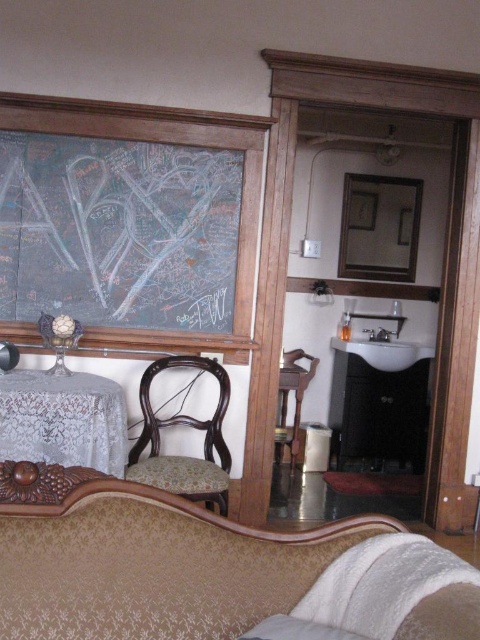
This screenshot has width=480, height=640. I want to click on lace fabric table at lower left, so [x=62, y=419].

Between lace fabric table at lower left and wooden chair at center, which one is positioned lower?

Positioned lower is wooden chair at center.

Who is more forward, (x=48, y=403) or (x=286, y=417)?

Point (x=48, y=403)

Locate an element on the screen. This screenshot has width=480, height=640. lace fabric table at lower left is located at coordinates (62, 419).

Does chalkboard at upper left lie behind wooden chair at lower left?

Yes, chalkboard at upper left is further from the viewer.

Does chalkboard at upper left appear over wooden chair at lower left?

Yes.

Find the location of a particular element. Image resolution: width=480 pixels, height=640 pixels. chalkboard at upper left is located at coordinates (166, 144).

Is point (156, 432) positioned in front of point (299, 381)?

Yes, point (156, 432) is closer to viewer.

Between point (180, 484) and point (276, 435), which one is positioned in front?

Positioned in front is point (180, 484).

Who is more distant from viewer, [196,484] or [282,378]?

The point [282,378] is more distant.

The height and width of the screenshot is (640, 480). What are the coordinates of `wooden chair at lower left` in the screenshot? It's located at (180, 456).